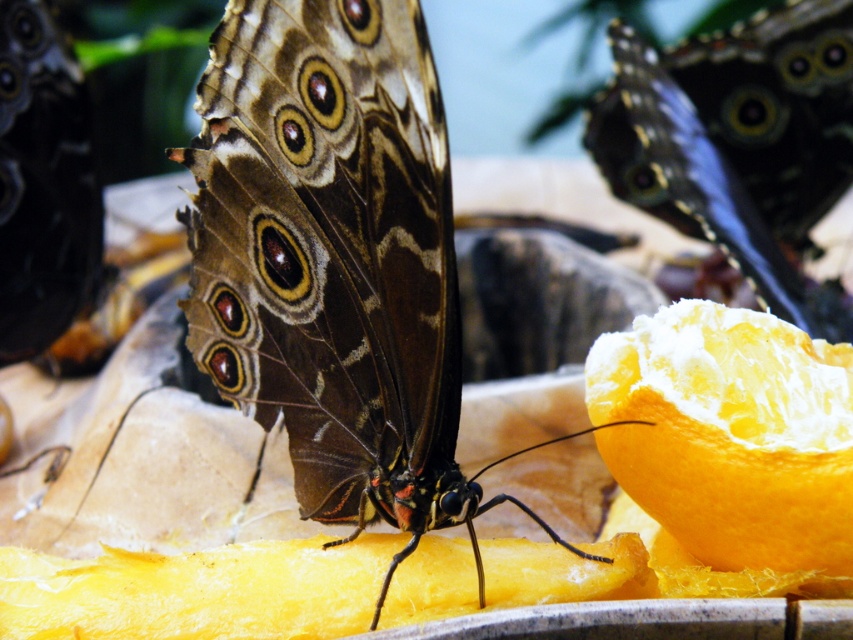
Question: Can you confirm if shiny brown butterfly at center is thinner than shiny blue butterfly at upper right?

Choices:
 (A) yes
 (B) no

Answer: (B)

Question: Which object is positioned farthest from the shiny brown butterfly at center?

Choices:
 (A) shiny blue butterfly at upper right
 (B) smooth orange at lower right

Answer: (A)

Question: Where is shiny brown butterfly at center located in relation to shiny blue butterfly at upper right in the image?

Choices:
 (A) right
 (B) left

Answer: (B)

Question: Which of these objects is positioned farthest from the smooth orange at lower right?

Choices:
 (A) shiny brown butterfly at center
 (B) shiny blue butterfly at upper right

Answer: (B)

Question: Which point is closer to the camera?

Choices:
 (A) smooth orange at lower right
 (B) shiny blue butterfly at upper right
 (C) shiny brown butterfly at center

Answer: (C)

Question: Is shiny brown butterfly at center smaller than shiny blue butterfly at upper right?

Choices:
 (A) yes
 (B) no

Answer: (A)